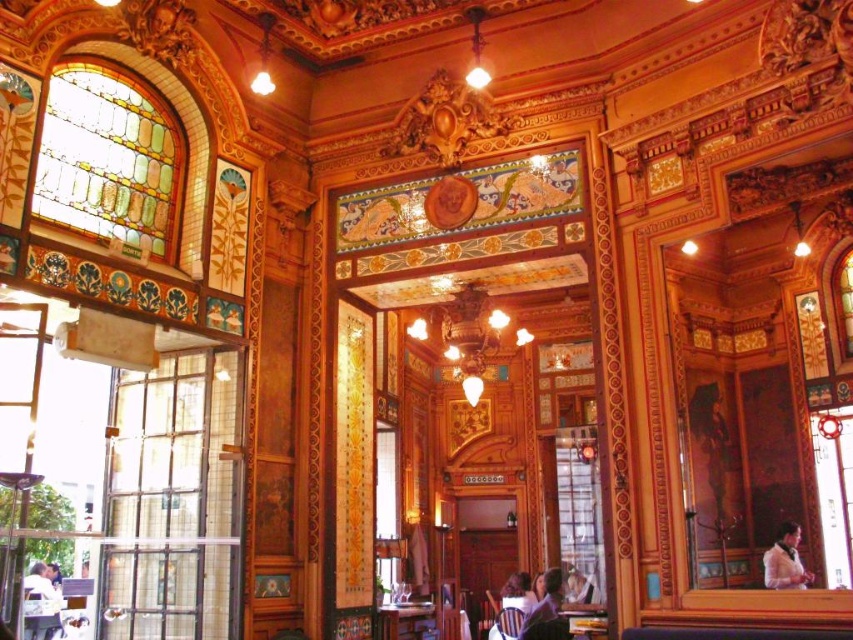
Question: Among these objects, which one is nearest to the camera?

Choices:
 (A) smooth brown hair at center
 (B) wooden table at center
 (C) light brown leather jacket at lower right

Answer: (A)

Question: Which of the following is the farthest from the observer?

Choices:
 (A) light brown leather jacket at lower right
 (B) wooden table at center
 (C) smooth brown hair at center

Answer: (A)

Question: Considering the real-world distances, which object is closest to the light brown leather jacket at lower right?

Choices:
 (A) wooden table at center
 (B) smooth brown hair at center

Answer: (B)

Question: Is wooden table at center behind smooth brown hair at center?

Choices:
 (A) no
 (B) yes

Answer: (B)

Question: Does light brown leather jacket at lower right have a lesser width compared to smooth brown hair at center?

Choices:
 (A) yes
 (B) no

Answer: (B)

Question: Can you confirm if wooden table at center is smaller than smooth brown hair at center?

Choices:
 (A) no
 (B) yes

Answer: (B)